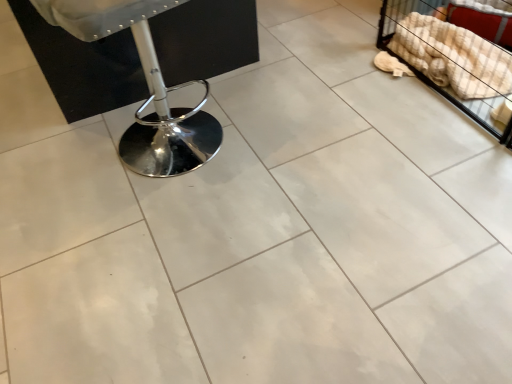
Question: Is chrome metallic swivel chair at left to the right of beige checkered blanket at upper right from the viewer's perspective?

Choices:
 (A) yes
 (B) no

Answer: (B)

Question: From a real-world perspective, is chrome metallic swivel chair at left on beige checkered blanket at upper right?

Choices:
 (A) yes
 (B) no

Answer: (A)

Question: Would you say beige checkered blanket at upper right is part of chrome metallic swivel chair at left's contents?

Choices:
 (A) yes
 (B) no

Answer: (B)

Question: Can you confirm if chrome metallic swivel chair at left is shorter than beige checkered blanket at upper right?

Choices:
 (A) no
 (B) yes

Answer: (A)

Question: Is chrome metallic swivel chair at left at the left side of beige checkered blanket at upper right?

Choices:
 (A) yes
 (B) no

Answer: (A)

Question: Is the depth of chrome metallic swivel chair at left less than that of beige checkered blanket at upper right?

Choices:
 (A) no
 (B) yes

Answer: (B)

Question: Can you confirm if beige checkered blanket at upper right is positioned to the left of chrome metallic swivel chair at left?

Choices:
 (A) no
 (B) yes

Answer: (A)

Question: Considering the relative sizes of beige checkered blanket at upper right and chrome metallic swivel chair at left in the image provided, is beige checkered blanket at upper right thinner than chrome metallic swivel chair at left?

Choices:
 (A) no
 (B) yes

Answer: (B)

Question: Is beige checkered blanket at upper right looking in the opposite direction of chrome metallic swivel chair at left?

Choices:
 (A) no
 (B) yes

Answer: (A)

Question: Is beige checkered blanket at upper right with chrome metallic swivel chair at left?

Choices:
 (A) yes
 (B) no

Answer: (B)

Question: Is beige checkered blanket at upper right outside of chrome metallic swivel chair at left?

Choices:
 (A) yes
 (B) no

Answer: (A)

Question: Does beige checkered blanket at upper right have a larger size compared to chrome metallic swivel chair at left?

Choices:
 (A) yes
 (B) no

Answer: (B)

Question: In the image, is beige checkered blanket at upper right positioned in front of or behind chrome metallic swivel chair at left?

Choices:
 (A) front
 (B) behind

Answer: (B)